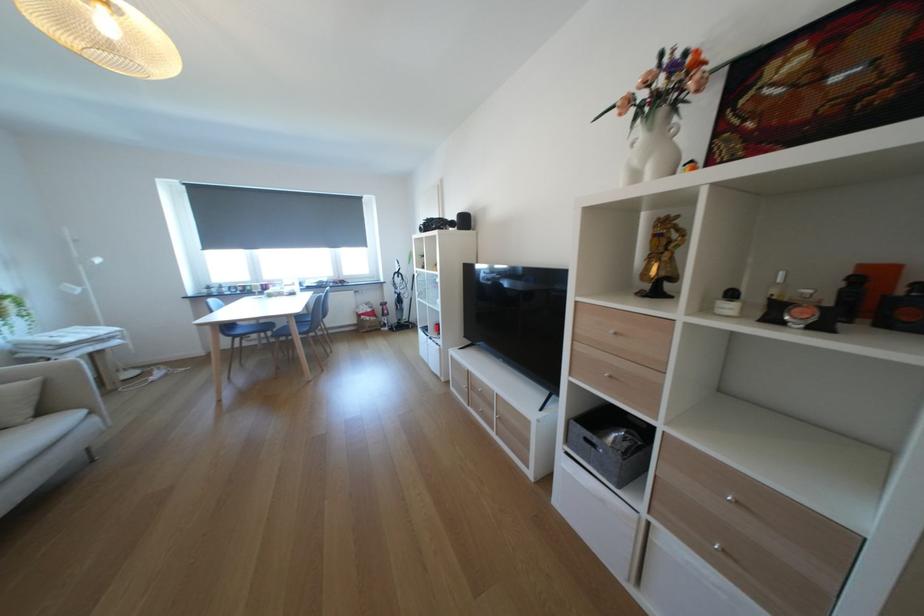
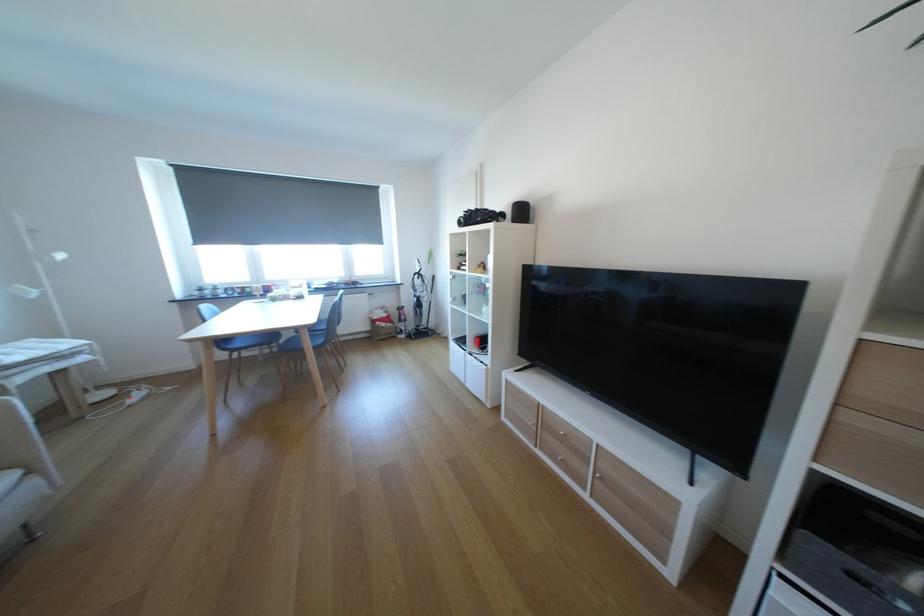
Question: The camera is either moving clockwise (left) or counter-clockwise (right) around the object. The first image is from the beginning of the video and the second image is from the end. Is the camera moving left or right when shooting the video?

Choices:
 (A) Left
 (B) Right

Answer: (A)